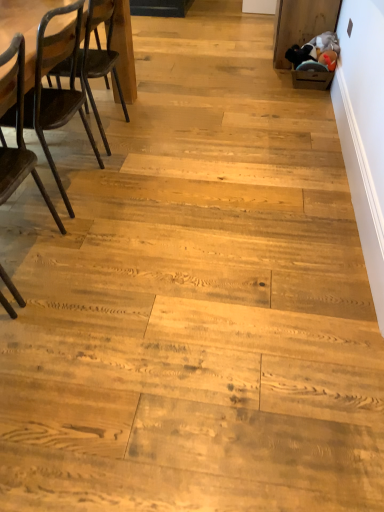
Question: From the image's perspective, is dark brown wood chair at left, the 1th chair viewed from the front, positioned above or below dark brown wood chair at left, marked as the first chair in a back-to-front arrangement?

Choices:
 (A) above
 (B) below

Answer: (B)

Question: Considering the positions of dark brown wood chair at left, the 1th chair viewed from the front, and dark brown wood chair at left, marked as the first chair in a back-to-front arrangement, in the image, is dark brown wood chair at left, the 1th chair viewed from the front, taller or shorter than dark brown wood chair at left, marked as the first chair in a back-to-front arrangement,?

Choices:
 (A) short
 (B) tall

Answer: (B)

Question: Which of these objects is positioned closest to the dark brown wood chair at left, positioned as the 2th chair in front-to-back order?

Choices:
 (A) dark brown wood table at left
 (B) dark brown wood chair at left, the 1th chair viewed from the front

Answer: (B)

Question: Which is nearer to the dark brown wood table at left?

Choices:
 (A) dark brown wood chair at left, positioned as the 2th chair in front-to-back order
 (B) dark brown wood chair at left, the 1th chair viewed from the front

Answer: (A)